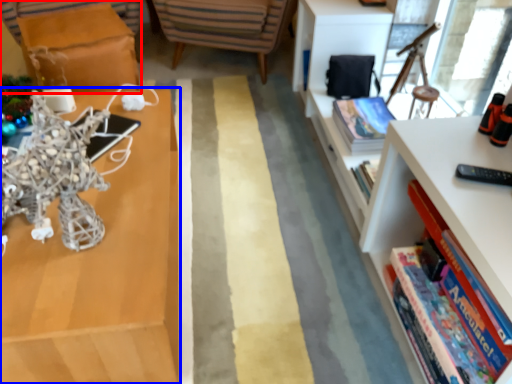
Question: Which of the following is the closest to the observer, table (highlighted by a red box) or shelf (highlighted by a blue box)?

Choices:
 (A) table
 (B) shelf

Answer: (B)